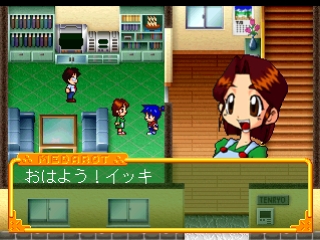
What are the coordinates of `staircase` in the screenshot? It's located at (299, 96).